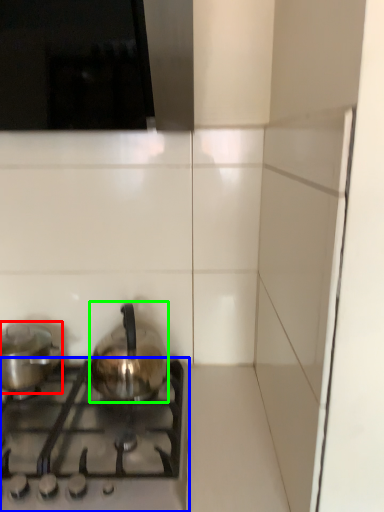
Question: Estimate the real-world distances between objects in this image. Which object is farther from kitchen appliance (highlighted by a red box), gas stove (highlighted by a blue box) or kitchen appliance (highlighted by a green box)?

Choices:
 (A) gas stove
 (B) kitchen appliance

Answer: (A)